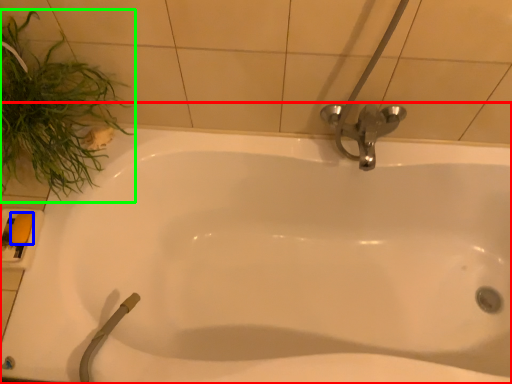
Question: Which object is positioned farthest from bathtub (highlighted by a red box)? Select from soap (highlighted by a blue box) and plant (highlighted by a green box).

Choices:
 (A) soap
 (B) plant

Answer: (A)